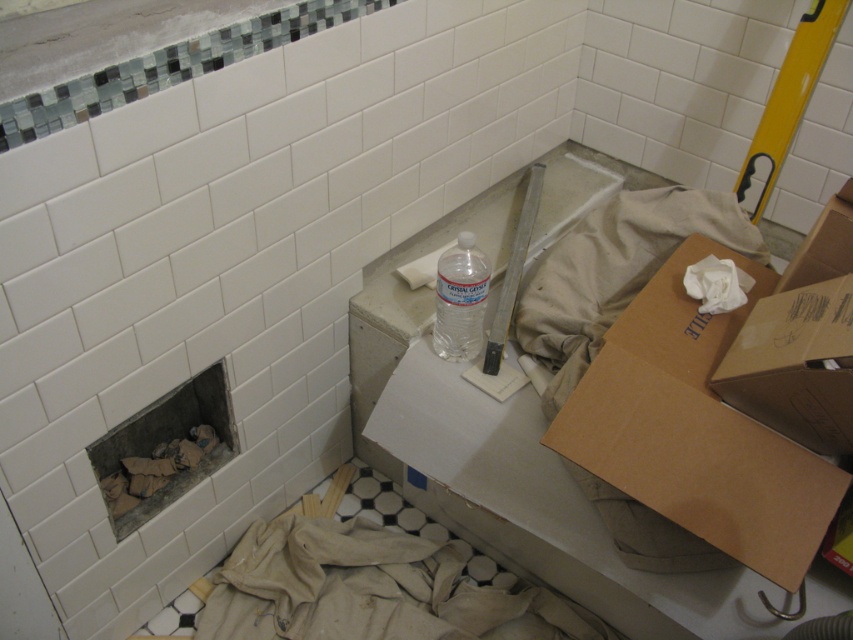
Question: From the image, what is the correct spatial relationship of clear plastic bottle at center in relation to white crumpled toilet paper at center-right?

Choices:
 (A) above
 (B) below

Answer: (B)

Question: Is clear plastic bottle at center in front of white matte toilet paper at center?

Choices:
 (A) yes
 (B) no

Answer: (A)

Question: Can you confirm if brown cardboard box at lower right is wider than clear plastic bottle at center?

Choices:
 (A) yes
 (B) no

Answer: (A)

Question: Among these objects, which one is farthest from the camera?

Choices:
 (A) clear plastic bottle at center
 (B) white matte toilet paper at center
 (C) brown cardboard box at lower right
 (D) white crumpled toilet paper at center-right

Answer: (B)

Question: Which point is closer to the camera taking this photo?

Choices:
 (A) (717, 292)
 (B) (416, 259)
 (C) (659, 385)

Answer: (C)

Question: Which object is positioned closest to the clear plastic bottle at center?

Choices:
 (A) brown cardboard box at lower right
 (B) white crumpled toilet paper at center-right

Answer: (A)